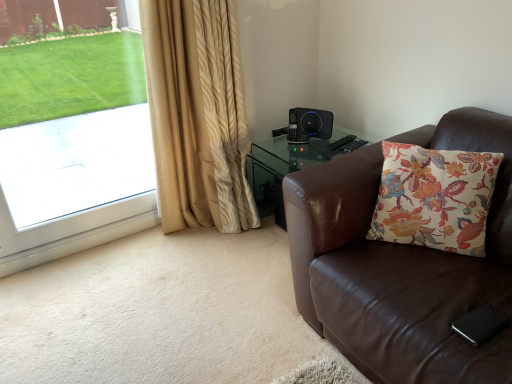
Question: From a real-world perspective, is brown leather chair at right on top of beige textured curtain at left?

Choices:
 (A) yes
 (B) no

Answer: (B)

Question: Is brown leather chair at right in front of beige textured curtain at left?

Choices:
 (A) yes
 (B) no

Answer: (A)

Question: Could you tell me if brown leather chair at right is turned towards beige textured curtain at left?

Choices:
 (A) no
 (B) yes

Answer: (A)

Question: From the image's perspective, does brown leather chair at right appear lower than beige textured curtain at left?

Choices:
 (A) yes
 (B) no

Answer: (A)

Question: Is brown leather chair at right completely or partially outside of beige textured curtain at left?

Choices:
 (A) no
 (B) yes

Answer: (B)

Question: Is brown leather chair at right facing away from beige textured curtain at left?

Choices:
 (A) yes
 (B) no

Answer: (B)

Question: From a real-world perspective, is white glass window at left physically above brown leather chair at right?

Choices:
 (A) yes
 (B) no

Answer: (A)

Question: Is white glass window at left taller than brown leather chair at right?

Choices:
 (A) yes
 (B) no

Answer: (A)

Question: Would you say white glass window at left is a long distance from brown leather chair at right?

Choices:
 (A) no
 (B) yes

Answer: (B)

Question: Does white glass window at left contain brown leather chair at right?

Choices:
 (A) no
 (B) yes

Answer: (A)

Question: Can you confirm if white glass window at left is thinner than brown leather chair at right?

Choices:
 (A) no
 (B) yes

Answer: (B)

Question: Can you confirm if white glass window at left is bigger than brown leather chair at right?

Choices:
 (A) no
 (B) yes

Answer: (A)

Question: Can you confirm if black plastic speaker at upper right is thinner than brown leather chair at right?

Choices:
 (A) yes
 (B) no

Answer: (A)